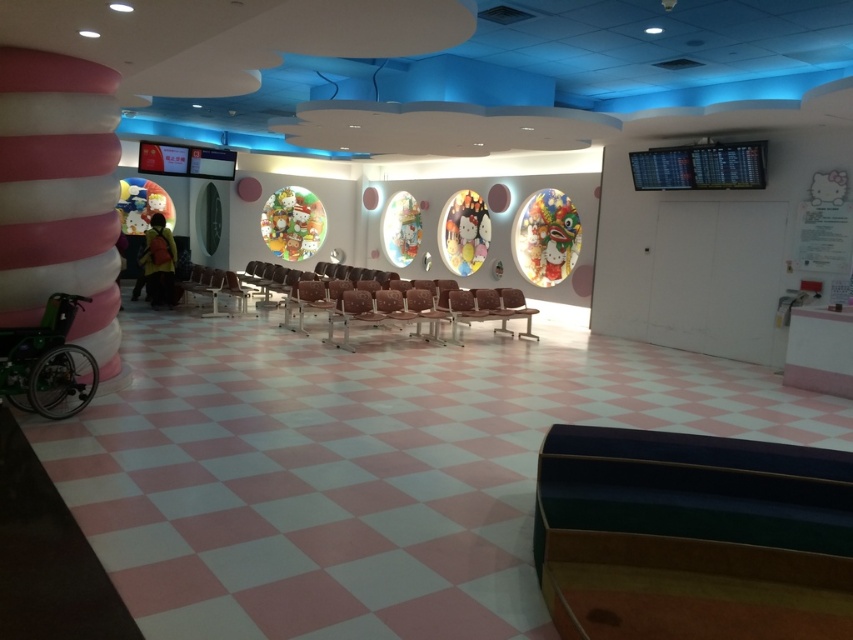
You are a person with mobility issues needing to reach the green plastic wheelchair at lower left from the dark green leather armchair at center. Can you walk directly to it without moving any objects?

The dark green leather armchair at center is in front of the green plastic wheelchair at lower left, so you would need to move the armchair to access the wheelchair directly.

You are a maintenance worker checking wheelchair accessibility in the waiting area. You see the dark green leather armchair at center and the green plastic wheelchair at lower left. Which object is taller?

The green plastic wheelchair at lower left is taller than the dark green leather armchair at center.